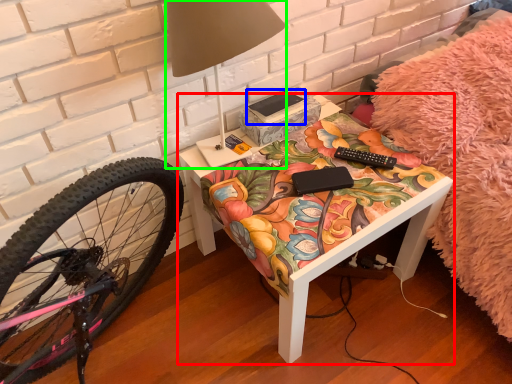
Question: Which object is positioned farthest from table (highlighted by a red box)? Select from book (highlighted by a blue box) and table lamp (highlighted by a green box).

Choices:
 (A) book
 (B) table lamp

Answer: (B)